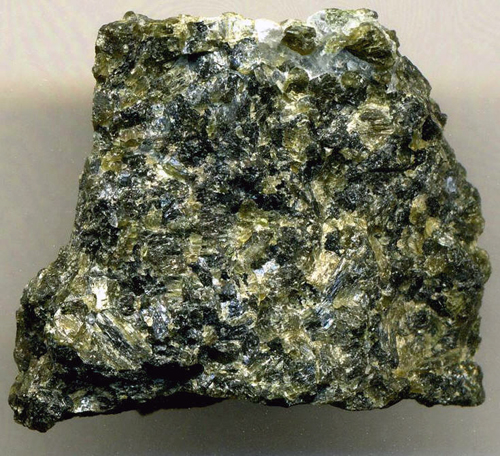
Where is `light source reflection`? This screenshot has width=500, height=456. light source reflection is located at coordinates (259, 19).